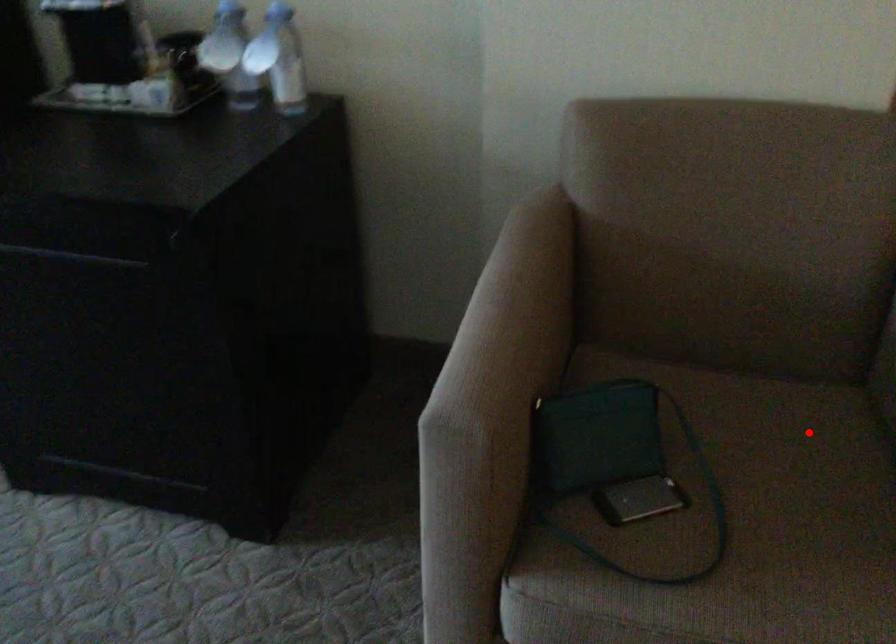
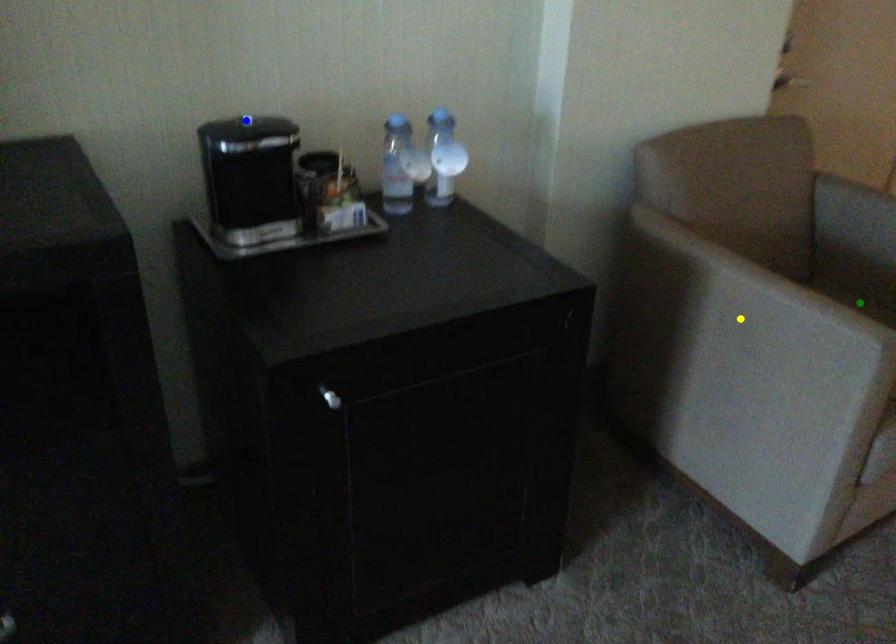
Question: I am providing you with two images of the same scene from different viewpoints. A red point is marked on the first image. You are given multiple points on the second image. Which mark in image 2 goes with the point in image 1?

Choices:
 (A) green point
 (B) blue point
 (C) yellow point

Answer: (A)